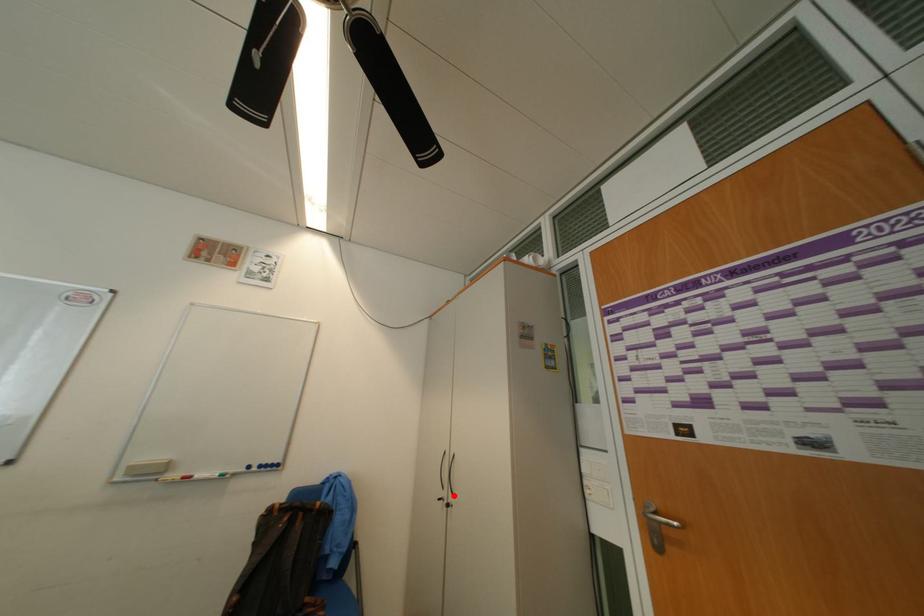
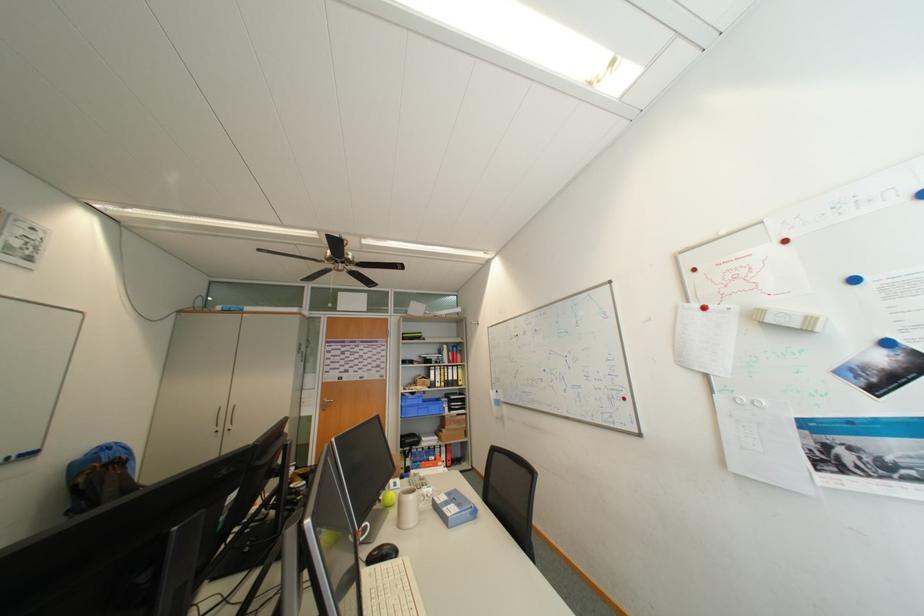
Where in the second image is the point corresponding to the highlighted location from the first image?

(229, 429)